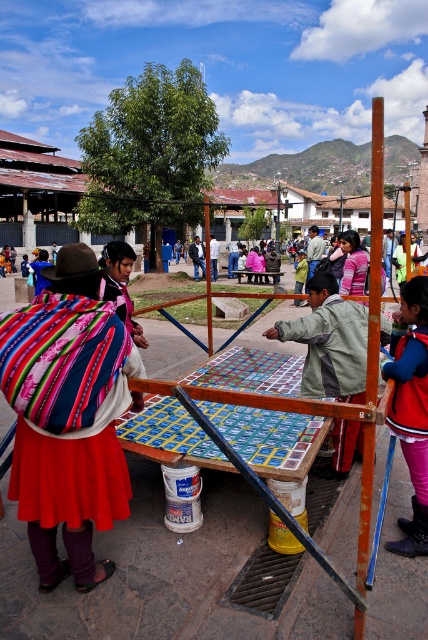
Question: Which of these objects is positioned farthest from the multicolored woven fabric at center?

Choices:
 (A) matte pink sweater at center
 (B) green fabric jacket at center

Answer: (A)

Question: Does velvet red coat at lower right lie in front of matte pink sweater at center?

Choices:
 (A) no
 (B) yes

Answer: (B)

Question: Does multicolored woven fabric at center have a greater width compared to velvet red coat at lower right?

Choices:
 (A) yes
 (B) no

Answer: (A)

Question: Which of these objects is positioned closest to the velvet red coat at lower right?

Choices:
 (A) multicolored woven fabric at center
 (B) green fabric jacket at center
 (C) matte pink sweater at center

Answer: (B)

Question: Which is farther from the green fabric jacket at center?

Choices:
 (A) matte pink sweater at center
 (B) multicolored woven fabric at center

Answer: (A)

Question: Does multicolored woven fabric at center have a larger size compared to green fabric jacket at center?

Choices:
 (A) no
 (B) yes

Answer: (B)